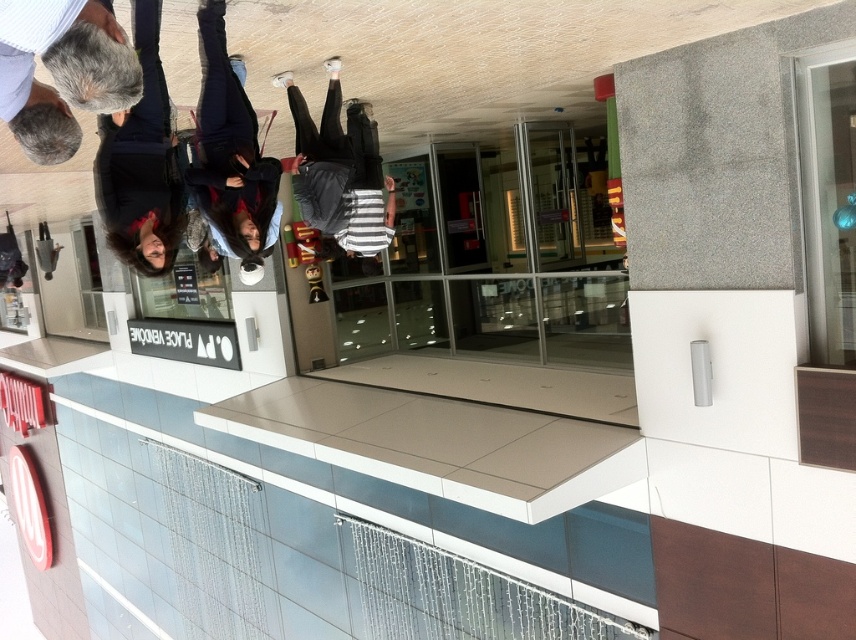
Which is more to the right, gray wool sweater at upper left or dark blue jeans at center?

gray wool sweater at upper left is more to the right.

Which is in front, point (94, 81) or point (229, 248)?

Positioned in front is point (94, 81).

Find the location of a particular element. The image size is (856, 640). gray wool sweater at upper left is located at coordinates (61, 72).

Is the position of gray wool sweater at upper left more distant than that of black matte pants at center?

No, it is not.

Is gray wool sweater at upper left wider than black matte pants at center?

No.

Between point (105, 104) and point (336, 150), which one is positioned behind?

The point (336, 150) is behind.

Locate an element on the screen. The width and height of the screenshot is (856, 640). gray wool sweater at upper left is located at coordinates (61, 72).

Can you confirm if dark brown leather jacket at upper left is wider than dark blue jeans at center?

Yes.

Is point (135, 193) less distant than point (224, 212)?

That is True.

The width and height of the screenshot is (856, 640). Identify the location of dark brown leather jacket at upper left. (140, 163).